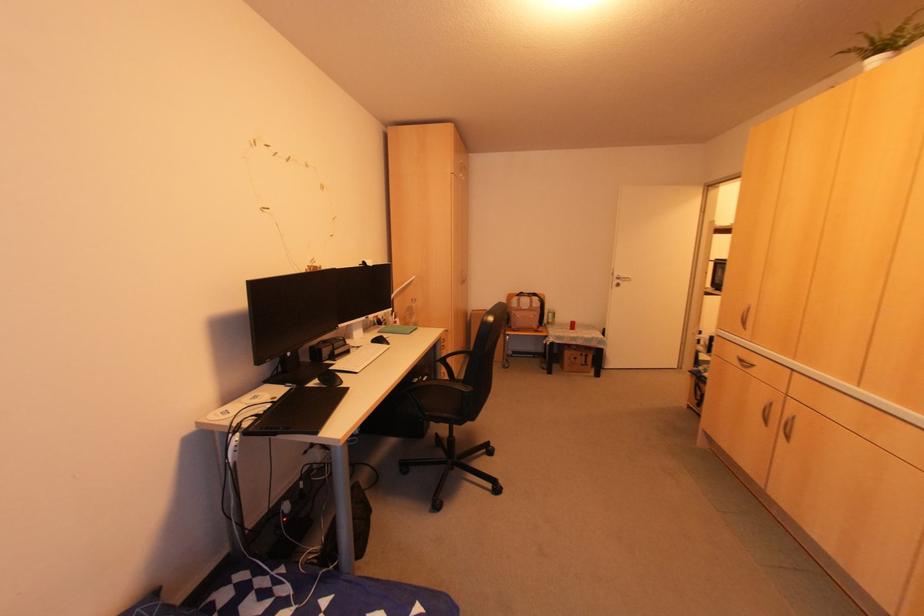
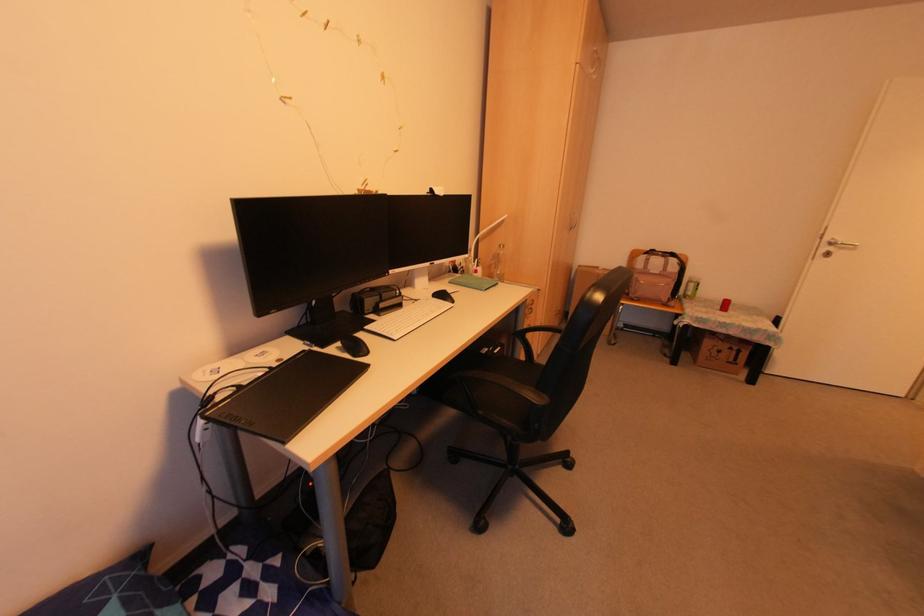
Locate, in the second image, the point that corresponds to (460,283) in the first image.

(568, 229)